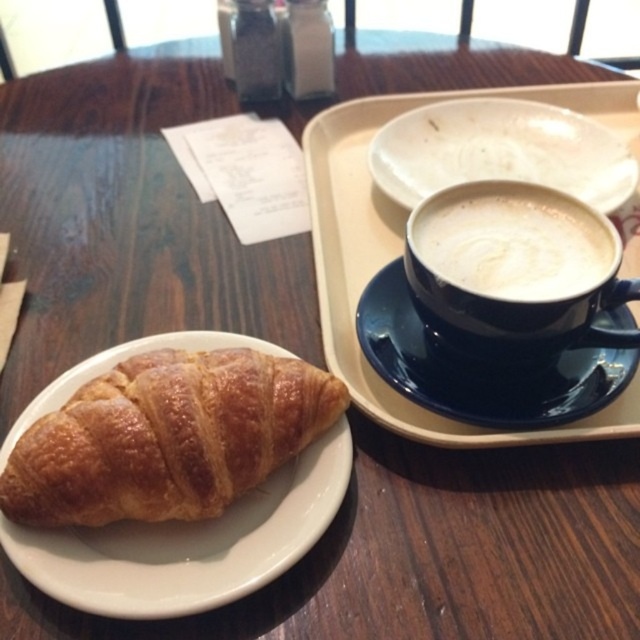
Does golden brown flaky croissant at lower left have a greater width compared to white frothy coffee at upper right?

Yes.

Does golden brown flaky croissant at lower left have a smaller size compared to white frothy coffee at upper right?

No, golden brown flaky croissant at lower left is not smaller than white frothy coffee at upper right.

Image resolution: width=640 pixels, height=640 pixels. I want to click on golden brown flaky croissant at lower left, so click(x=168, y=436).

Can you confirm if white frothy cappuccino at upper right is bigger than white ceramic plate at upper center?

Actually, white frothy cappuccino at upper right might be smaller than white ceramic plate at upper center.

Does white frothy cappuccino at upper right appear under white ceramic plate at upper center?

Yes.

Is point (465, 353) farther from camera compared to point (506, 168)?

No, it is not.

Where is `white frothy cappuccino at upper right`? The height and width of the screenshot is (640, 640). white frothy cappuccino at upper right is located at coordinates (515, 272).

Does white ceramic plate at upper center have a larger size compared to white frothy coffee at upper right?

Indeed, white ceramic plate at upper center has a larger size compared to white frothy coffee at upper right.

Which is more to the left, white ceramic plate at upper center or white frothy coffee at upper right?

white frothy coffee at upper right is more to the left.

Find the location of a particular element. The width and height of the screenshot is (640, 640). white ceramic plate at upper center is located at coordinates click(500, 150).